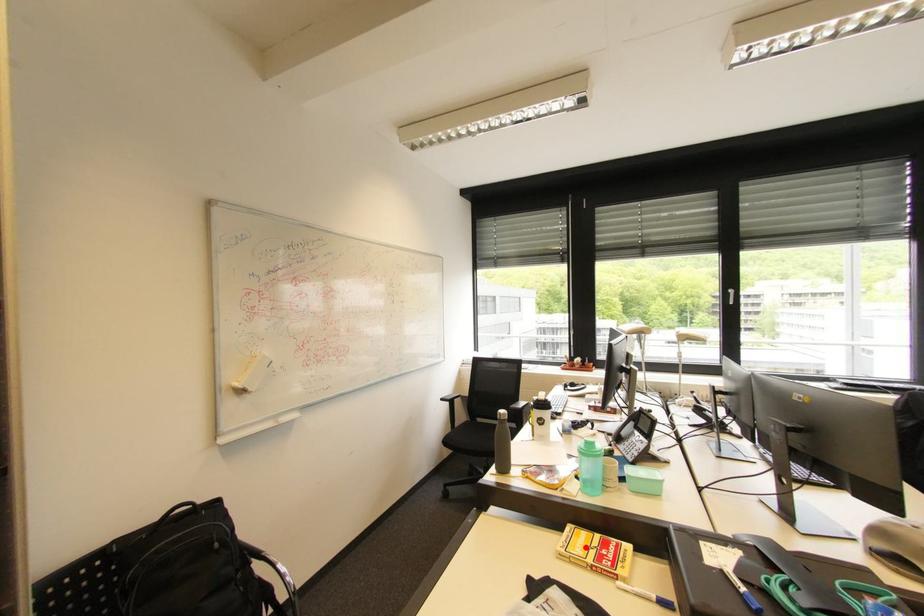
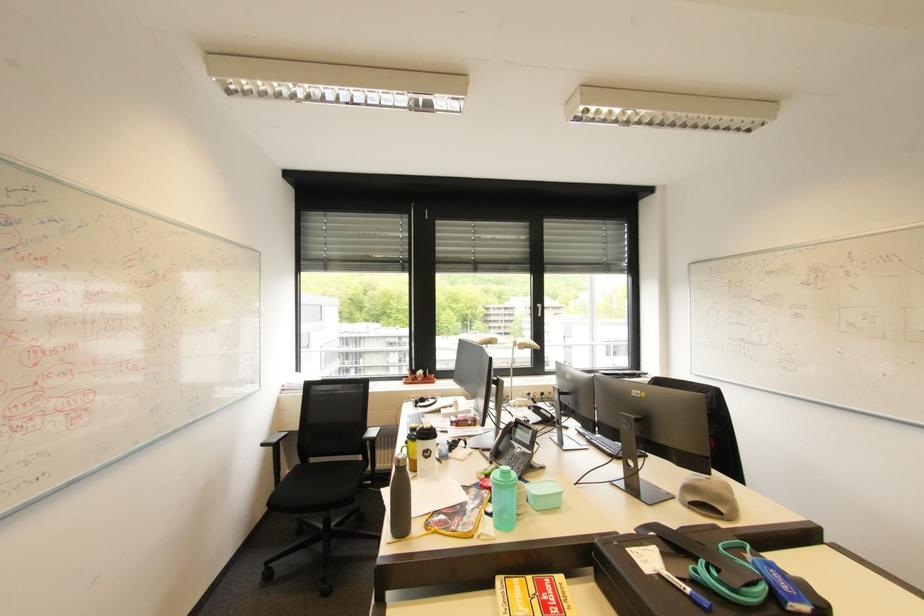
Question: I am providing you with two images of the same scene from different viewpoints. A red point is marked on the first image. Is the red point's position out of view in image 2?

Choices:
 (A) Yes
 (B) No

Answer: (B)